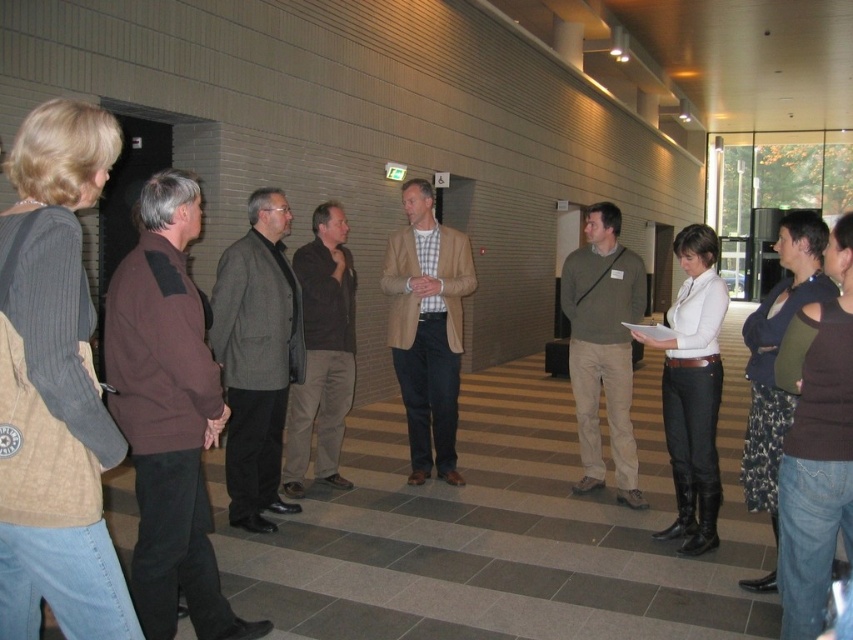
You are a tailor who needs to determine which garment requires more fabric for alterations. Based on the image, which of the two garments has a greater width between the brown fabric jacket at left and the gray wool blazer at center?

The brown fabric jacket at left has a greater width than the gray wool blazer at center, so it requires more fabric for alterations.

You are standing in the hallway and need to locate the brown fabric jacket at left and the gray wool blazer at center. Which one is positioned to the right of the other?

The brown fabric jacket at left is to the right of the gray wool blazer at center.

You are a photographer trying to capture a clear shot of the white matte shirt at center without the brown fabric jacket at left blocking it. Can you adjust your angle to avoid the jacket?

The brown fabric jacket at left is positioned over the white matte shirt at center, so adjusting your angle to look underneath or around the jacket might allow you to capture the shirt without obstruction.